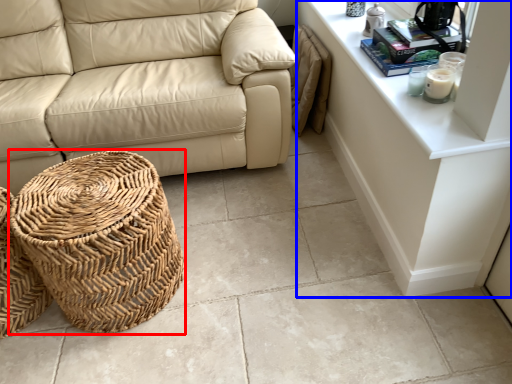
Question: Which object is closer to the camera taking this photo, basket (highlighted by a red box) or dresser (highlighted by a blue box)?

Choices:
 (A) basket
 (B) dresser

Answer: (B)